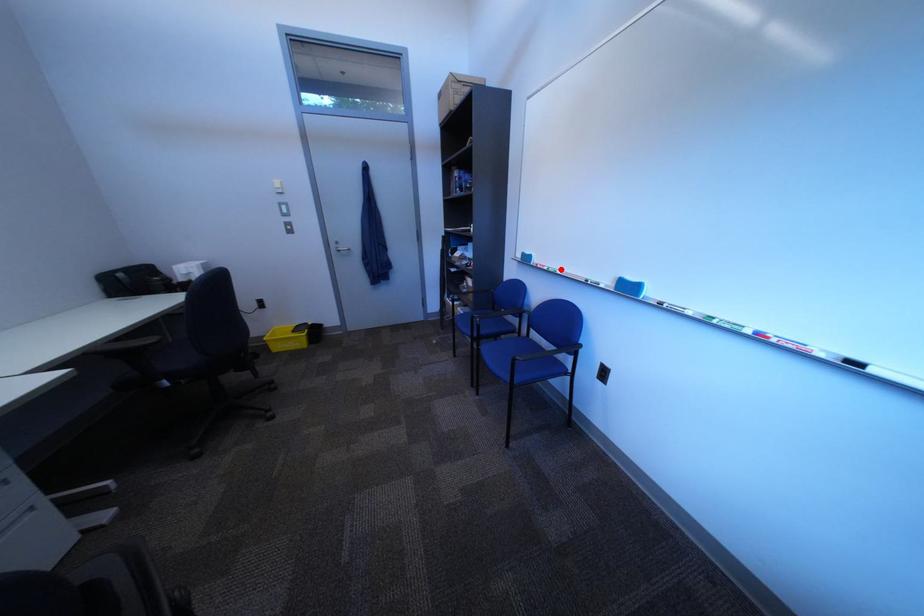
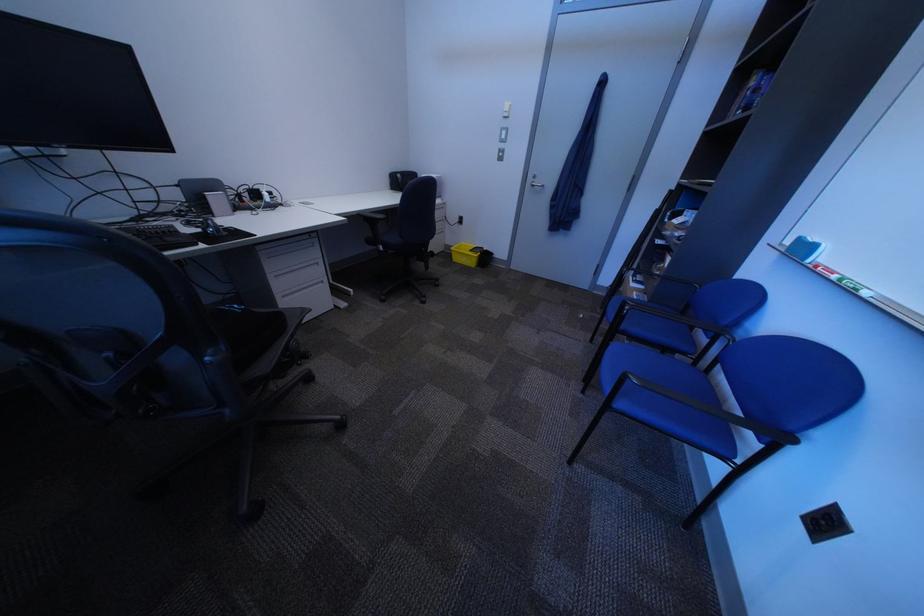
Where in the second image is the point corresponding to the highlighted location from the first image?

(849, 278)